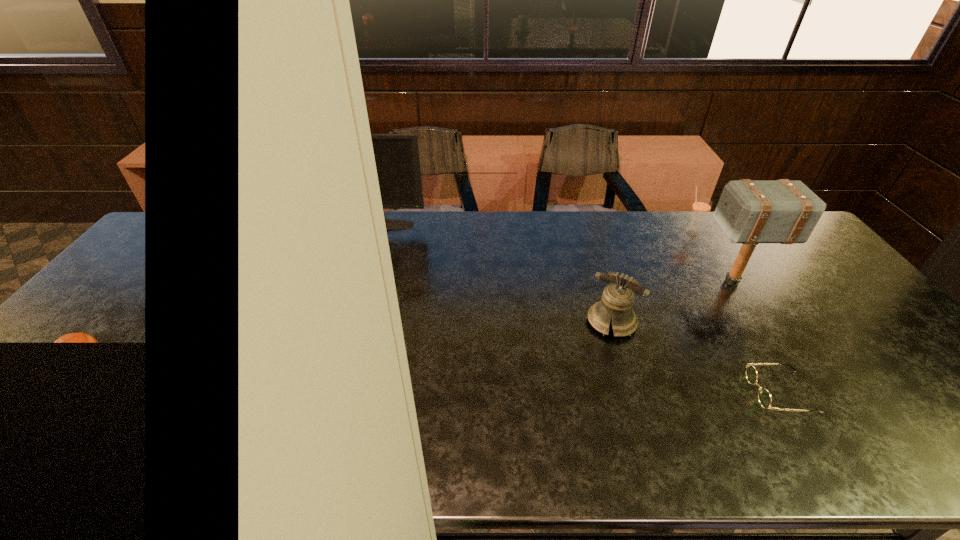
Where is `vacant space at the right edge of the desktop`? vacant space at the right edge of the desktop is located at coordinates (794, 289).

The image size is (960, 540). Find the location of `vacant space at the far left corner of the desktop`. vacant space at the far left corner of the desktop is located at coordinates (194, 220).

Image resolution: width=960 pixels, height=540 pixels. Identify the location of free location at the near left corner of the desktop. (29, 444).

At what (x,y) coordinates should I click in order to perform the action: click on free area in between the shortest object and the monitor. Please return your answer as a coordinate pair (x, y). The width and height of the screenshot is (960, 540). Looking at the image, I should click on (572, 309).

The width and height of the screenshot is (960, 540). I want to click on free space between the shortest object and the fourth farthest object, so click(696, 357).

Image resolution: width=960 pixels, height=540 pixels. I want to click on empty location between the straw and the leftmost object, so click(527, 230).

At what (x,y) coordinates should I click in order to perform the action: click on vacant area between the straw and the bell. Please return your answer as a coordinate pair (x, y). Looking at the image, I should click on (651, 278).

Identify the location of vacant area that lies between the straw and the spectacles. (736, 313).

Find the location of a particular element. This screenshot has height=540, width=960. empty space between the nearest object and the mallet is located at coordinates (756, 337).

The image size is (960, 540). What are the coordinates of `vacant area that lies between the third nearest object and the straw` in the screenshot? It's located at (711, 258).